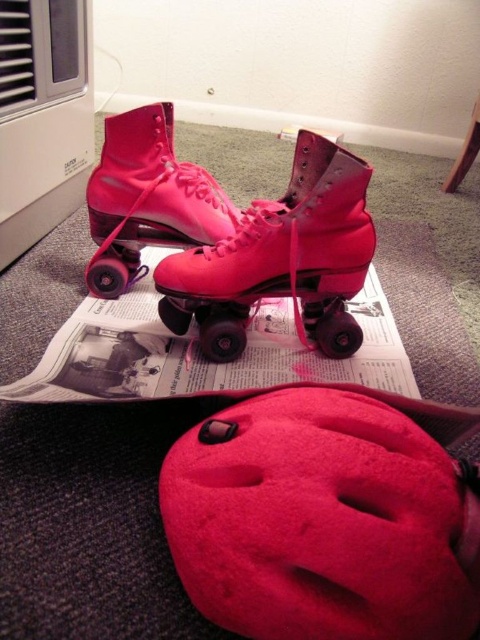
Question: Which point is farther to the camera?

Choices:
 (A) printed paper magazine at center
 (B) matte pink roller skate at center
 (C) pink matte roller skate at center

Answer: (C)

Question: Can you confirm if printed paper magazine at center is smaller than pink matte roller skate at center?

Choices:
 (A) yes
 (B) no

Answer: (B)

Question: Which of the following is the farthest from the observer?

Choices:
 (A) pink matte roller skate at center
 (B) matte pink roller skate at center
 (C) printed paper magazine at center

Answer: (A)

Question: Which is nearer to the printed paper magazine at center?

Choices:
 (A) pink matte roller skate at center
 (B) matte pink roller skate at center

Answer: (B)

Question: Observing the image, what is the correct spatial positioning of matte pink roller skate at center in reference to printed paper magazine at center?

Choices:
 (A) right
 (B) left

Answer: (A)

Question: Does matte pink roller skate at center have a greater width compared to printed paper magazine at center?

Choices:
 (A) no
 (B) yes

Answer: (A)